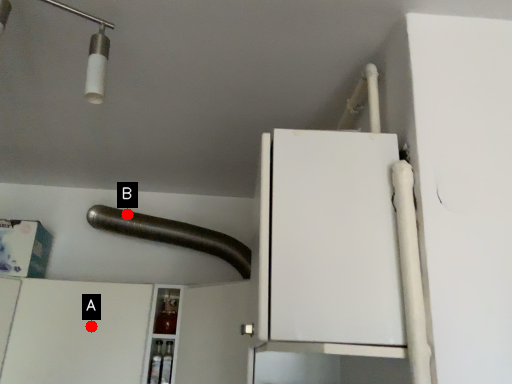
Question: Two points are circled on the image, labeled by A and B beside each circle. Which point appears closest to the camera in this image?

Choices:
 (A) A is closer
 (B) B is closer

Answer: (A)